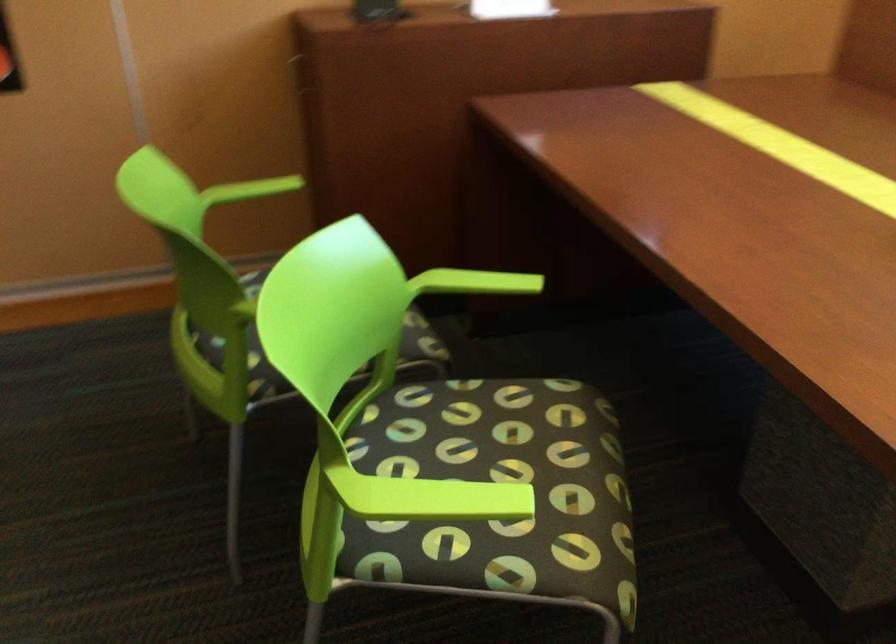
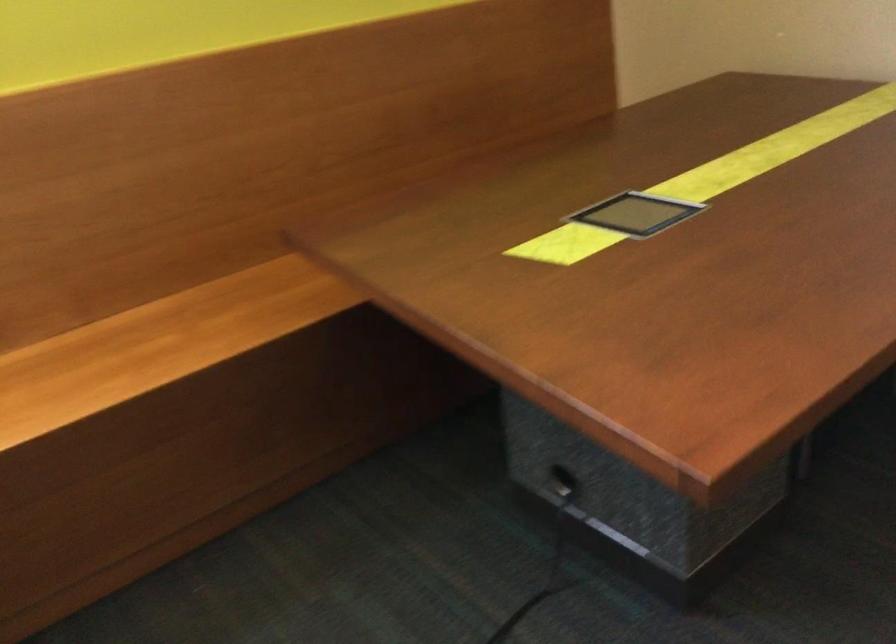
First-person continuous shooting, in which direction is the camera rotating?

The camera's rotation is toward right-down.